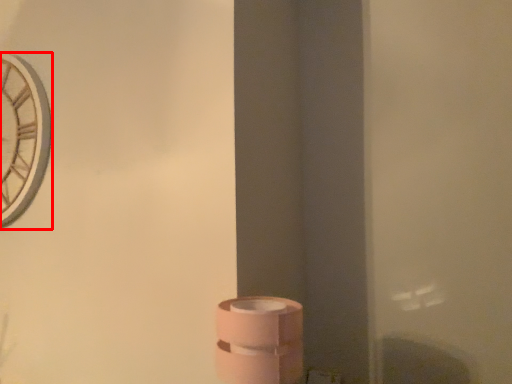
Question: Where is clock (annotated by the red box) located in relation to toilet paper in the image?

Choices:
 (A) left
 (B) right

Answer: (A)